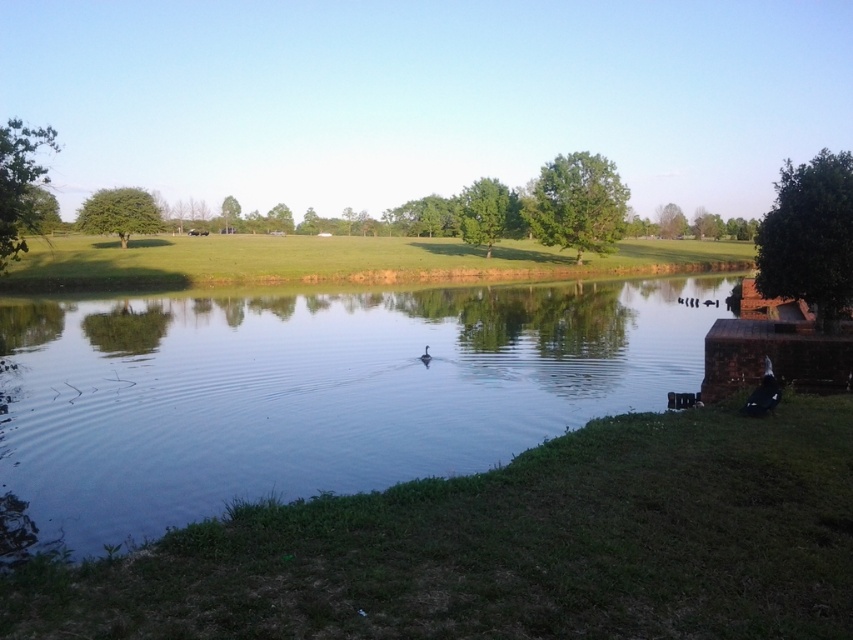
Question: Which point is farther to the camera?

Choices:
 (A) (355, 388)
 (B) (426, 353)
 (C) (752, 410)
 (D) (200, 250)

Answer: (D)

Question: Which point is closer to the camera taking this photo?

Choices:
 (A) (743, 260)
 (B) (764, 378)
 (C) (73, 349)
 (D) (428, 355)

Answer: (B)

Question: Based on their relative distances, which object is nearer to the green grassy field at center?

Choices:
 (A) dark gray feathers at lower right
 (B) black matte duck at center

Answer: (B)

Question: Can you confirm if clear water at center is positioned to the right of green grassy field at center?

Choices:
 (A) no
 (B) yes

Answer: (A)

Question: Can you confirm if green grassy field at center is positioned below black matte duck at center?

Choices:
 (A) yes
 (B) no

Answer: (B)

Question: Does green grassy field at center have a lesser width compared to black matte duck at center?

Choices:
 (A) yes
 (B) no

Answer: (B)